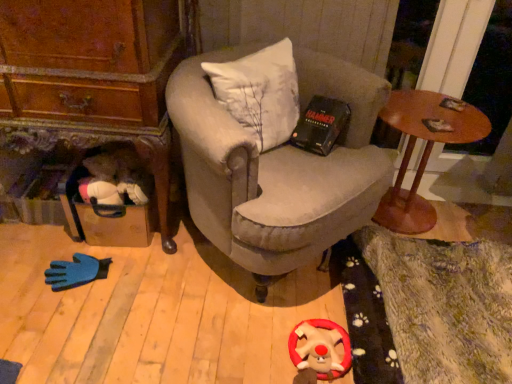
Identify the location of free space to the left of velvety red plush reindeer at lower center. (261, 351).